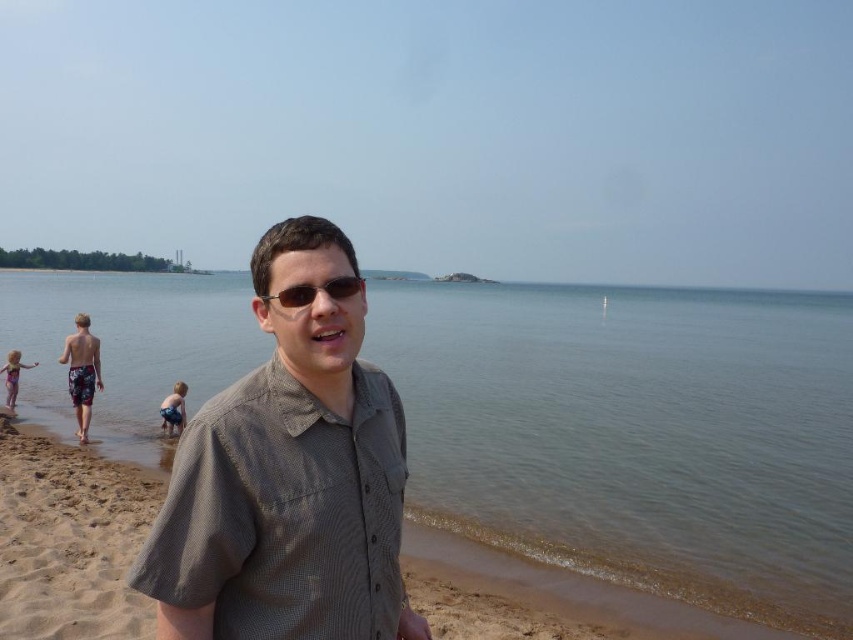
Does point (842, 298) lie in front of point (196, 493)?

No, (842, 298) is further to viewer.

Find the location of a particular element. The height and width of the screenshot is (640, 853). clear water at beach front is located at coordinates (636, 435).

The height and width of the screenshot is (640, 853). What are the coordinates of `clear water at beach front` in the screenshot? It's located at (636, 435).

Which of these two, clear water at beach front or blue denim shorts at lower left, stands shorter?

With less height is blue denim shorts at lower left.

Can you confirm if clear water at beach front is wider than blue denim shorts at lower left?

Indeed, clear water at beach front has a greater width compared to blue denim shorts at lower left.

Is point (850, 316) positioned behind point (177, 420)?

That is True.

Identify the location of clear water at beach front. (636, 435).

Can you confirm if clear water at beach front is positioned below light pink swimsuit at lower left?

Actually, clear water at beach front is above light pink swimsuit at lower left.

Between clear water at beach front and light pink swimsuit at lower left, which one appears on the left side from the viewer's perspective?

Positioned to the left is light pink swimsuit at lower left.

Between point (561, 484) and point (7, 355), which one is positioned in front?

Point (561, 484) is in front.

The image size is (853, 640). I want to click on clear water at beach front, so click(636, 435).